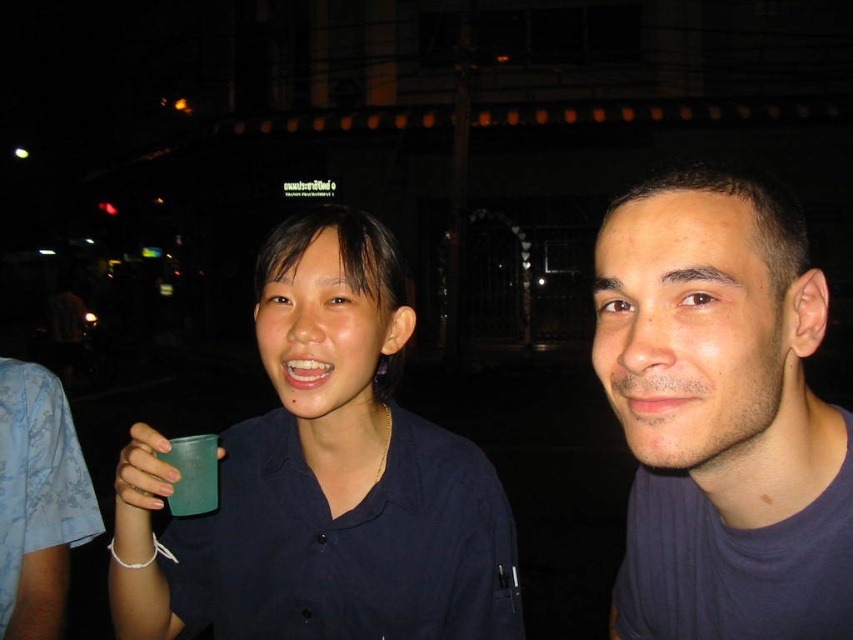
Question: Which of the following is the closest to the observer?

Choices:
 (A) matte plastic cup at center
 (B) dark blue t-shirt at right
 (C) green plastic cup at lower left

Answer: (B)

Question: Is matte plastic cup at center positioned at the back of green plastic cup at lower left?

Choices:
 (A) yes
 (B) no

Answer: (B)

Question: Does dark blue t-shirt at right have a greater width compared to green plastic cup at lower left?

Choices:
 (A) yes
 (B) no

Answer: (A)

Question: Which point is farther from the camera taking this photo?

Choices:
 (A) (157, 500)
 (B) (674, 492)

Answer: (B)

Question: Does matte plastic cup at center appear on the left side of dark blue t-shirt at right?

Choices:
 (A) yes
 (B) no

Answer: (A)

Question: Considering the real-world distances, which object is closest to the dark blue t-shirt at right?

Choices:
 (A) green plastic cup at lower left
 (B) matte plastic cup at center

Answer: (B)